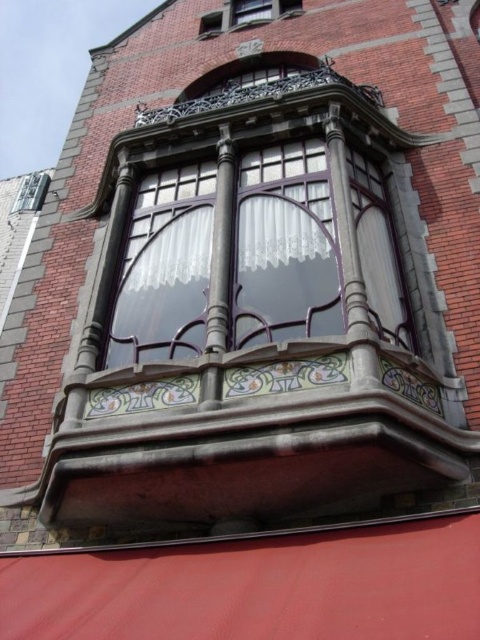
Question: Can you confirm if matte glass window at center is positioned above matte glass window at upper center?

Choices:
 (A) yes
 (B) no

Answer: (B)

Question: Is matte glass window at center smaller than matte glass window at upper center?

Choices:
 (A) yes
 (B) no

Answer: (B)

Question: Which point is farther to the camera?

Choices:
 (A) (x=237, y=1)
 (B) (x=272, y=291)

Answer: (A)

Question: Does matte glass window at center lie behind matte glass window at upper center?

Choices:
 (A) no
 (B) yes

Answer: (A)

Question: Which of the following is the closest to the observer?

Choices:
 (A) (259, 12)
 (B) (308, 220)

Answer: (B)